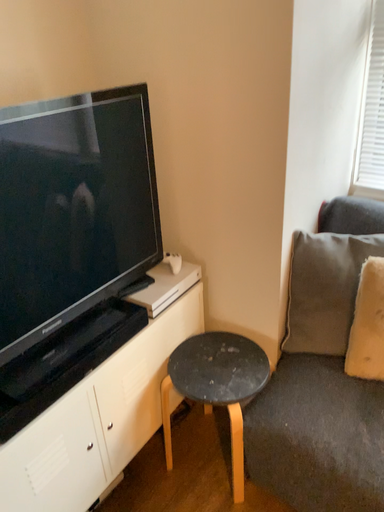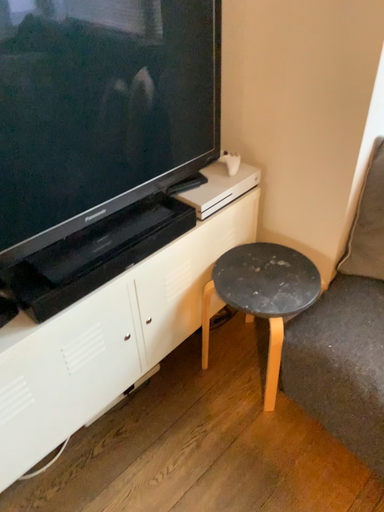
Question: How did the camera likely rotate when shooting the video?

Choices:
 (A) rotated upward
 (B) rotated downward

Answer: (B)